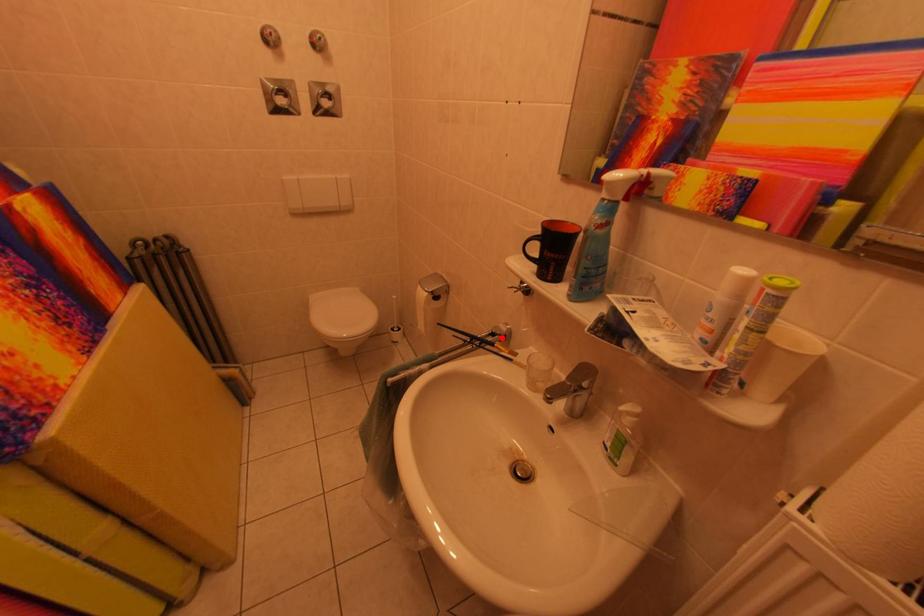
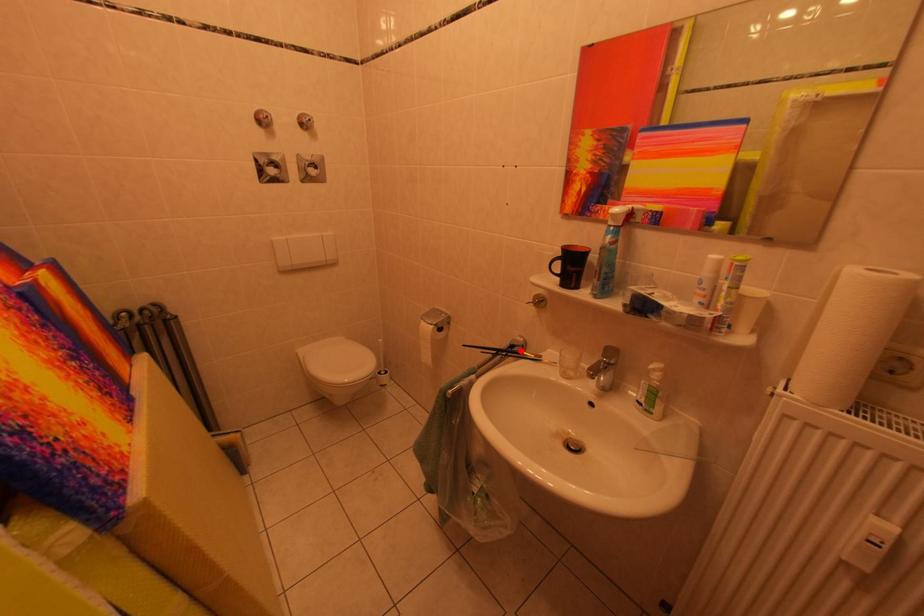
I am providing you with two images of the same scene from different viewpoints. A red point is marked on the first image and another point is marked on the second image. Is the red point in image1 aligned with the point shown in image2?

Yes